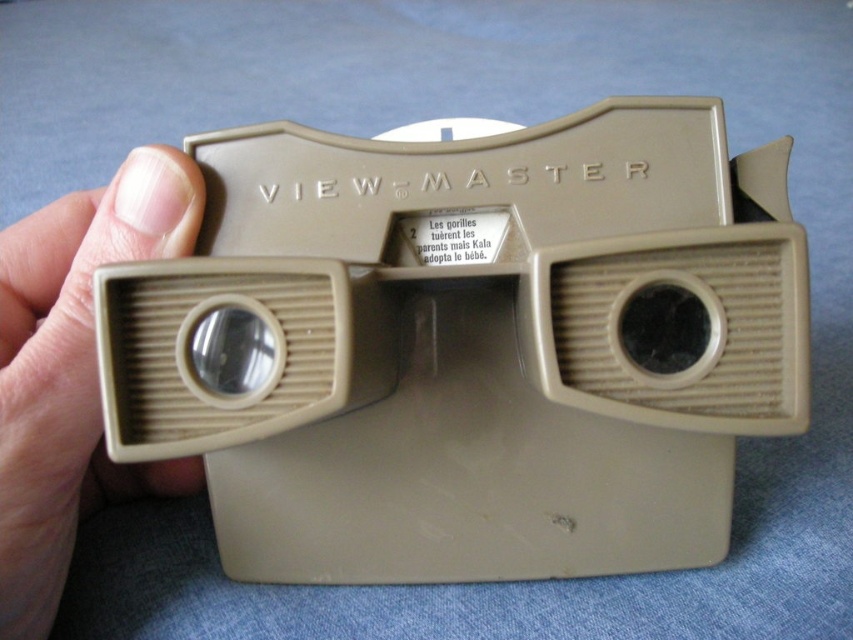
Question: Among these points, which one is farthest from the camera?

Choices:
 (A) (93, 364)
 (B) (233, 186)

Answer: (B)

Question: Does beige plastic view-master at center have a larger size compared to matte plastic lens at center left?

Choices:
 (A) no
 (B) yes

Answer: (B)

Question: Which object appears farthest from the camera in this image?

Choices:
 (A) pink skin at left
 (B) beige plastic view-master at center
 (C) matte plastic lens at center left

Answer: (A)

Question: Does pink skin at left appear on the left side of matte plastic lens at center left?

Choices:
 (A) no
 (B) yes

Answer: (B)

Question: Does beige plastic view-master at center appear under matte plastic lens at center left?

Choices:
 (A) yes
 (B) no

Answer: (A)

Question: Which point appears closest to the camera in this image?

Choices:
 (A) (4, 579)
 (B) (142, 278)
 (C) (222, 316)

Answer: (B)